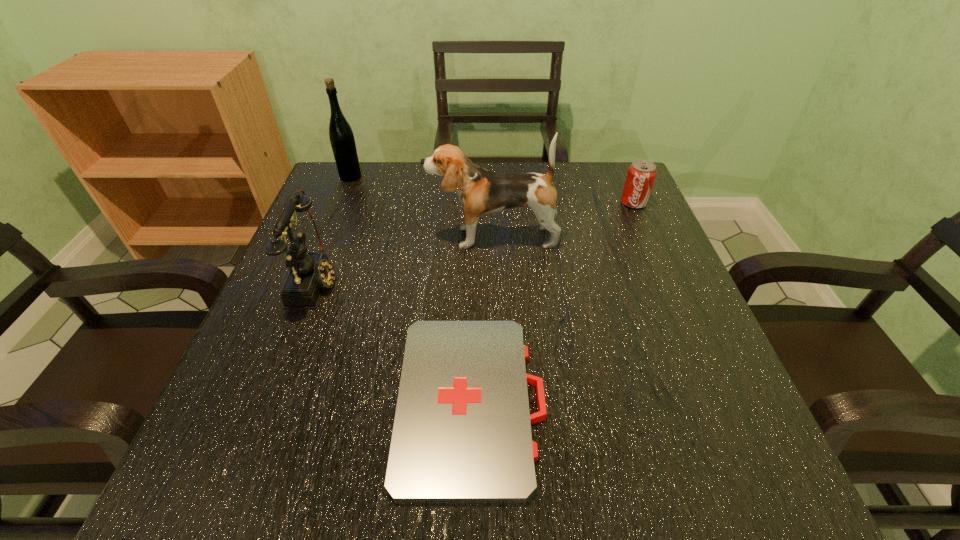
At what (x,y) coordinates should I click in order to perform the action: click on beer bottle. Please return your answer as a coordinate pair (x, y). This screenshot has width=960, height=540. Looking at the image, I should click on (342, 140).

Identify the location of puppy. The width and height of the screenshot is (960, 540). (481, 192).

The height and width of the screenshot is (540, 960). What are the coordinates of `telephone` in the screenshot? It's located at (310, 272).

Locate an element on the screen. The height and width of the screenshot is (540, 960). the second farthest object is located at coordinates (x=641, y=174).

The height and width of the screenshot is (540, 960). I want to click on the second shortest object, so click(x=641, y=174).

Locate an element on the screen. The height and width of the screenshot is (540, 960). the shortest object is located at coordinates (462, 433).

Image resolution: width=960 pixels, height=540 pixels. Identify the location of the first-aid kit. (462, 433).

This screenshot has height=540, width=960. I want to click on free space located on the right of the beer bottle, so click(x=465, y=177).

You are a GUI agent. You are given a task and a screenshot of the screen. Output one action in this format:
    pyautogui.click(x=<x>, y=<y>)
    Task: Click on the free spot located at the face of the puppy
    The height and width of the screenshot is (540, 960).
    Given the screenshot: What is the action you would take?
    pyautogui.click(x=330, y=237)

Identify the location of vacant space situated at the face of the puppy. (361, 237).